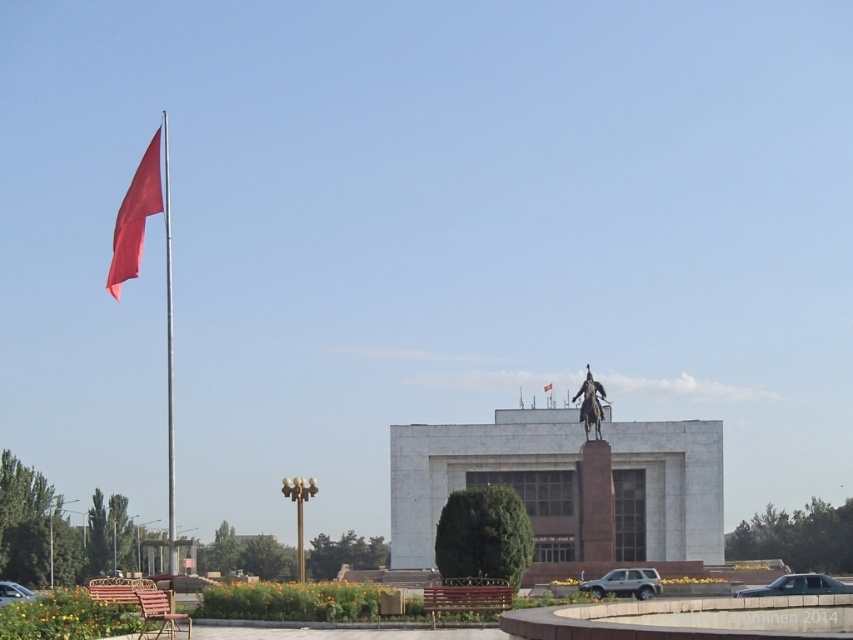
Question: Is metallic gray sedan at lower right wider than bronze statue at upper center?

Choices:
 (A) no
 (B) yes

Answer: (B)

Question: Which object is positioned farthest from the red fabric flag at upper left?

Choices:
 (A) smooth red flag at left
 (B) silver metallic suv at center
 (C) metallic gray sedan at lower right

Answer: (B)

Question: Which of the following is the closest to the observer?

Choices:
 (A) metallic gray sedan at lower right
 (B) metallic flag pole at left
 (C) metallic silver car at lower left
 (D) silver metallic suv at center

Answer: (B)

Question: Can you confirm if smooth red flag at left is positioned to the right of metallic gray sedan at lower right?

Choices:
 (A) no
 (B) yes

Answer: (A)

Question: Is bronze statue at upper center to the right of red fabric flag at upper left from the viewer's perspective?

Choices:
 (A) yes
 (B) no

Answer: (B)

Question: Which point is closer to the camera?

Choices:
 (A) silver metallic suv at center
 (B) metallic silver car at lower left
 (C) smooth red flag at left
 (D) red fabric flag at upper left

Answer: (C)